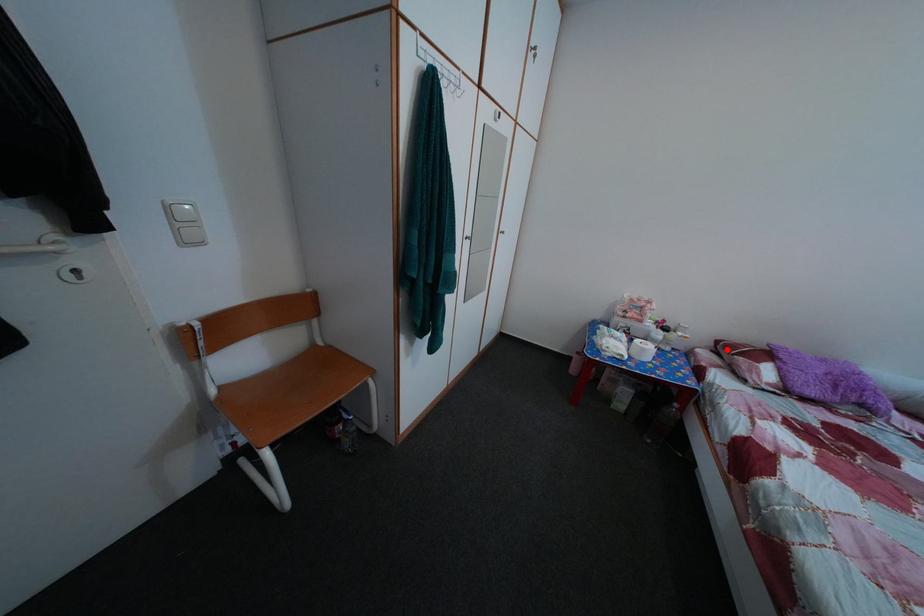
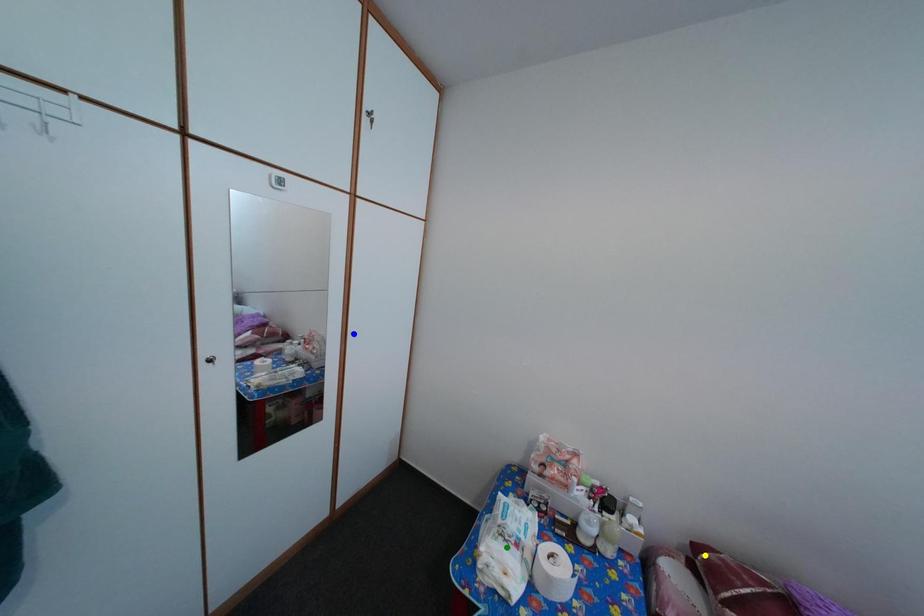
Question: I am providing you with two images of the same scene from different viewpoints. A red point is marked on the first image. You are given multiple points on the second image. Which mark in image 2 goes with the point in image 1?

Choices:
 (A) yellow point
 (B) green point
 (C) blue point

Answer: (A)